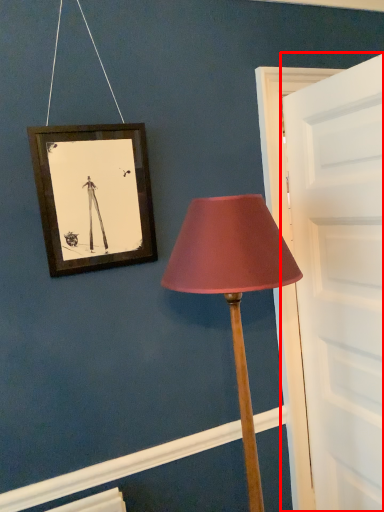
Question: From the image's perspective, where is door (annotated by the red box) located relative to lamp?

Choices:
 (A) below
 (B) above

Answer: (B)